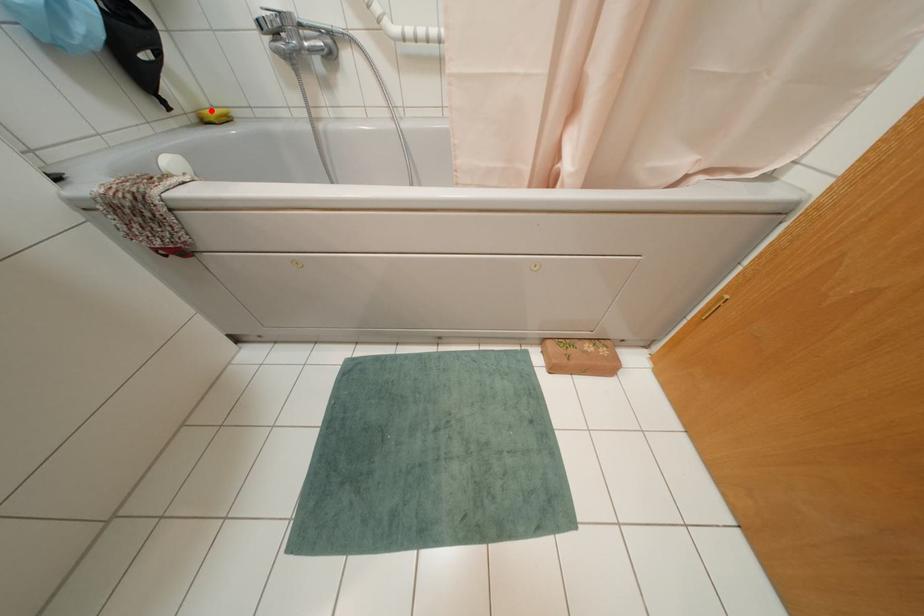
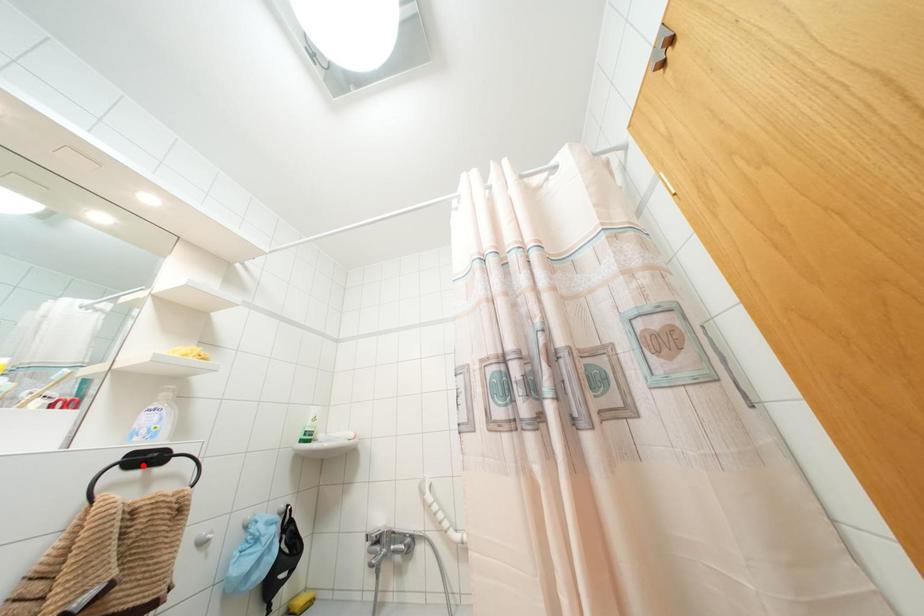
I am providing you with two images of the same scene from different viewpoints. A red point is marked on the first image and another point is marked on the second image. Do the highlighted points in image1 and image2 indicate the same real-world spot?

No